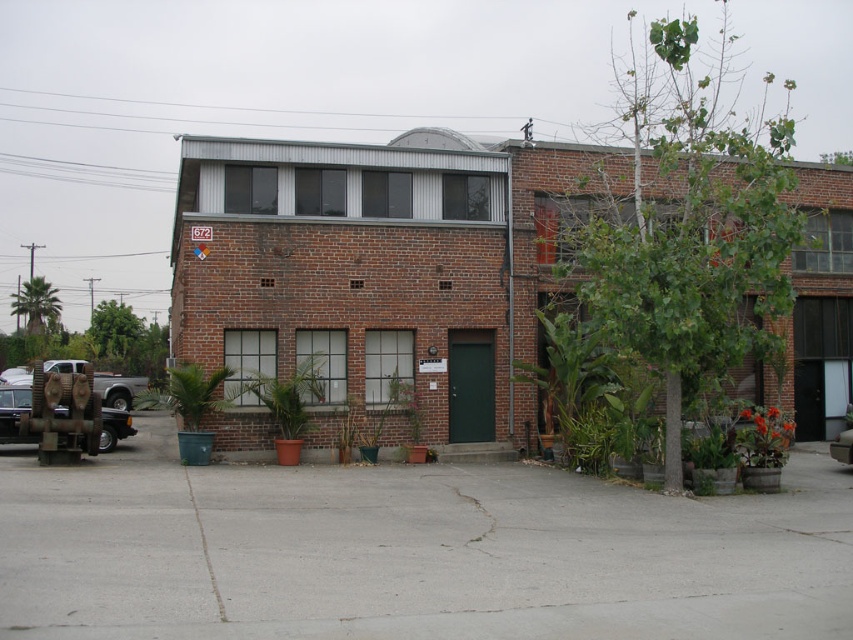
Question: Can you confirm if green matte plant at center is thinner than rusty metal truck at lower left?

Choices:
 (A) no
 (B) yes

Answer: (A)

Question: Considering the real-world distances, which object is farthest from the rusty metal truck at lower left?

Choices:
 (A) green matte plant at center
 (B) green matte plant at lower right
 (C) metallic silver car at center
 (D) green plastic pot at lower left

Answer: (C)

Question: Can you confirm if green plastic pot at lower left is positioned to the left of rusty metal truck at lower left?

Choices:
 (A) no
 (B) yes

Answer: (B)

Question: Among these objects, which one is nearest to the camera?

Choices:
 (A) green matte plant at center
 (B) metallic silver car at center
 (C) rusty metal truck at lower left
 (D) green matte plant at lower right

Answer: (D)

Question: Among these points, which one is nearest to the camera?

Choices:
 (A) (834, 458)
 (B) (300, 364)

Answer: (A)

Question: Is green matte plant at center to the left of green matte plant at lower right from the viewer's perspective?

Choices:
 (A) yes
 (B) no

Answer: (A)